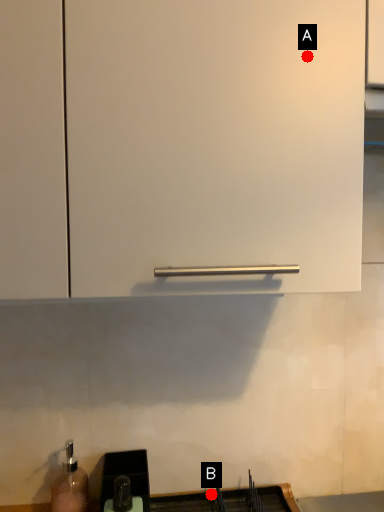
Question: Two points are circled on the image, labeled by A and B beside each circle. Which point is closer to the camera?

Choices:
 (A) A is closer
 (B) B is closer

Answer: (A)